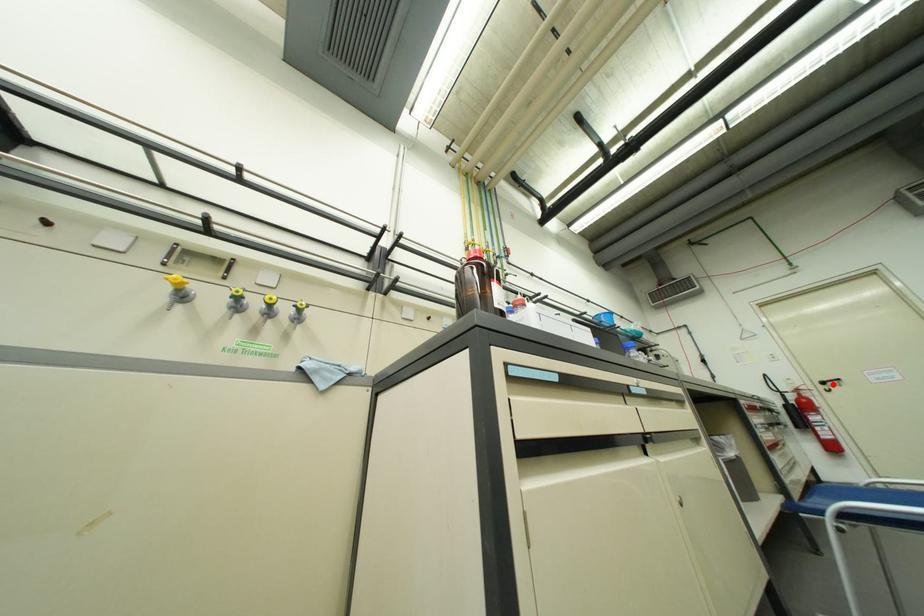
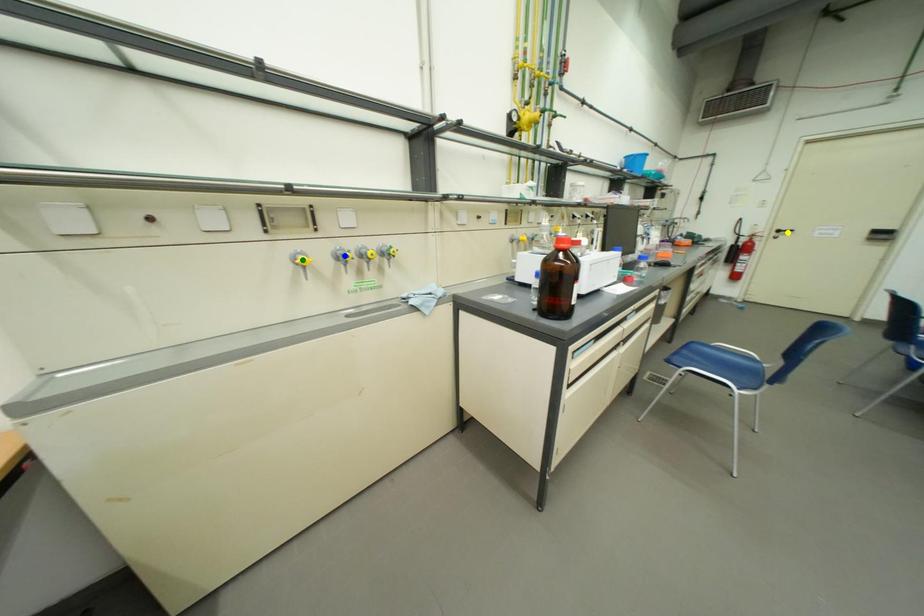
Question: I am providing you with two images of the same scene from different viewpoints. A red point is marked on the first image. You are given multiple points on the second image. In image 2, which mark is for the same physical point as the one in image 1?

Choices:
 (A) green point
 (B) yellow point
 (C) blue point

Answer: (B)